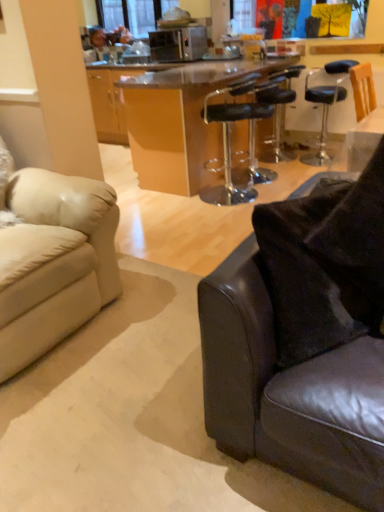
Question: Considering their positions, is leather couch at lower right, acting as the first studio couch starting from the right, located in front of or behind black leather bar stool at center, which is the second chair from front to back?

Choices:
 (A) front
 (B) behind

Answer: (A)

Question: Looking at their shapes, would you say leather couch at lower right, acting as the first studio couch starting from the right, is wider or thinner than black leather bar stool at center, arranged as the first chair when viewed from the back?

Choices:
 (A) thin
 (B) wide

Answer: (A)

Question: Estimate the real-world distances between objects in this image. Which object is farther from the black leather bar stool at center, which appears as the 2th chair when viewed from the left?

Choices:
 (A) satin silver microwave oven at upper center
 (B) clear glass window screen at upper center
 (C) beige leather couch at left, which appears as the second studio couch when viewed from the right
 (D) transparent acrylic table at center
 (E) transparent plastic bar stool at center, which appears as the first chair when viewed from the front

Answer: (B)

Question: Which of these objects is positioned farthest from the leather couch at lower right, acting as the first studio couch starting from the right?

Choices:
 (A) transparent acrylic table at center
 (B) satin silver microwave oven at upper center
 (C) transparent plastic bar stool at center, the 2th chair positioned from the back
 (D) clear glass window screen at upper center
 (E) black leather bar stool at center, which appears as the 2th chair when viewed from the left

Answer: (D)